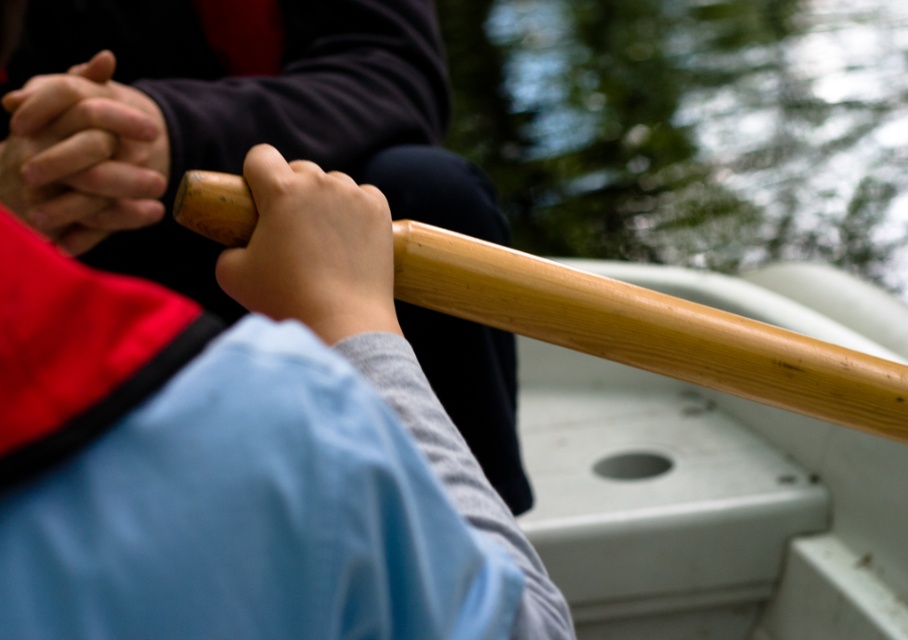
Question: Does natural wood paddle at center have a smaller size compared to wooden paddle handle at center?

Choices:
 (A) no
 (B) yes

Answer: (A)

Question: Can you confirm if natural wood paddle at center is positioned below wooden paddle handle at center?

Choices:
 (A) no
 (B) yes

Answer: (B)

Question: Which point is farther to the camera?

Choices:
 (A) wooden paddle handle at center
 (B) matte black hands at center
 (C) natural wood paddle at center

Answer: (B)

Question: Can you confirm if natural wood paddle at center is positioned above wooden paddle handle at center?

Choices:
 (A) yes
 (B) no

Answer: (B)

Question: Which of the following is the farthest from the observer?

Choices:
 (A) (307, 241)
 (B) (269, 426)
 (C) (854, 422)

Answer: (C)

Question: Which point is farther to the camera?

Choices:
 (A) (79, 196)
 (B) (135, 330)
 (C) (411, 237)
 (D) (334, 300)

Answer: (A)